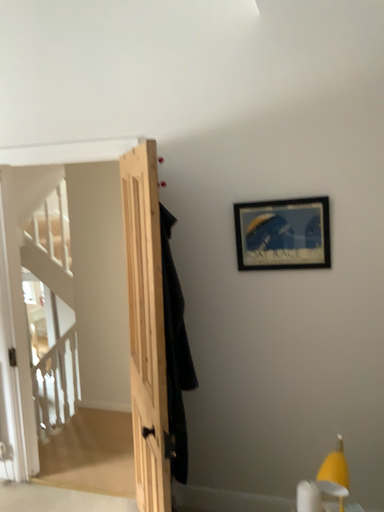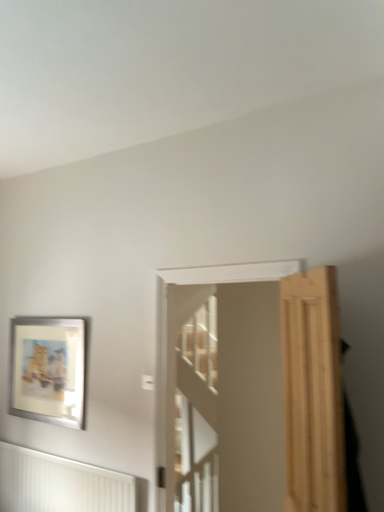
Question: How did the camera likely rotate when shooting the video?

Choices:
 (A) rotated right
 (B) rotated left

Answer: (B)